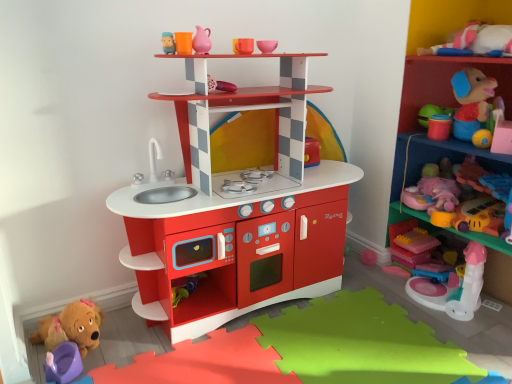
Question: Should I look upward or downward to see rubberized plastic toys at upper right, marked as the 2th shelf in a left-to-right arrangement?

Choices:
 (A) down
 (B) up

Answer: (B)

Question: Which direction should I rotate to face smooth plastic shelf at center, which ranks as the second shelf in right-to-left order, — up or down?

Choices:
 (A) up
 (B) down

Answer: (A)

Question: Does smooth plastic shelf at center, which ranks as the second shelf in right-to-left order, have a larger size compared to pink plush toy at right, which is the 1th toy in right-to-left order?

Choices:
 (A) yes
 (B) no

Answer: (A)

Question: Is smooth plastic shelf at center, the 1th shelf viewed from the left, not within pink plush toy at right, which is the 1th toy in right-to-left order?

Choices:
 (A) no
 (B) yes

Answer: (B)

Question: Is smooth plastic shelf at center, which ranks as the second shelf in right-to-left order, to the right of pink plush toy at right, which ranks as the 9th toy in left-to-right order, from the viewer's perspective?

Choices:
 (A) no
 (B) yes

Answer: (A)

Question: Considering the relative sizes of smooth plastic shelf at center, which ranks as the second shelf in right-to-left order, and pink plush toy at right, which ranks as the 9th toy in left-to-right order, in the image provided, is smooth plastic shelf at center, which ranks as the second shelf in right-to-left order, taller than pink plush toy at right, which ranks as the 9th toy in left-to-right order,?

Choices:
 (A) yes
 (B) no

Answer: (A)

Question: Is pink plush toy at right, which is the 1th toy in right-to-left order, inside smooth plastic shelf at center, the 1th shelf viewed from the left?

Choices:
 (A) yes
 (B) no

Answer: (B)

Question: Considering the relative sizes of smooth plastic shelf at center, which ranks as the second shelf in right-to-left order, and pink plush toy at right, which is the 1th toy in right-to-left order, in the image provided, is smooth plastic shelf at center, which ranks as the second shelf in right-to-left order, smaller than pink plush toy at right, which is the 1th toy in right-to-left order,?

Choices:
 (A) yes
 (B) no

Answer: (B)

Question: From the image's perspective, is pink plush toy at right, which ranks as the 9th toy in left-to-right order, located above translucent plastic blocks at lower right, which ranks as the second toy in right-to-left order?

Choices:
 (A) yes
 (B) no

Answer: (A)

Question: Can you confirm if pink plush toy at right, which ranks as the 9th toy in left-to-right order, is positioned to the right of translucent plastic blocks at lower right, which ranks as the second toy in right-to-left order?

Choices:
 (A) no
 (B) yes

Answer: (B)

Question: Is pink plush toy at right, which ranks as the 9th toy in left-to-right order, completely or partially outside of translucent plastic blocks at lower right, which ranks as the second toy in right-to-left order?

Choices:
 (A) yes
 (B) no

Answer: (A)

Question: Is translucent plastic blocks at lower right, which appears as the 8th toy when viewed from the left, completely or partially inside pink plush toy at right, which ranks as the 9th toy in left-to-right order?

Choices:
 (A) no
 (B) yes

Answer: (A)

Question: Is pink plush toy at right, which is the 1th toy in right-to-left order, wider than translucent plastic blocks at lower right, which appears as the 8th toy when viewed from the left?

Choices:
 (A) no
 (B) yes

Answer: (B)

Question: Could you tell me if pink plush toy at right, which ranks as the 9th toy in left-to-right order, is facing translucent plastic blocks at lower right, which ranks as the second toy in right-to-left order?

Choices:
 (A) no
 (B) yes

Answer: (A)

Question: Can you confirm if pink plastic unicorn at upper right, which ranks as the seventh toy in left-to-right order, is thinner than pink plush toy at right, which ranks as the 9th toy in left-to-right order?

Choices:
 (A) yes
 (B) no

Answer: (B)